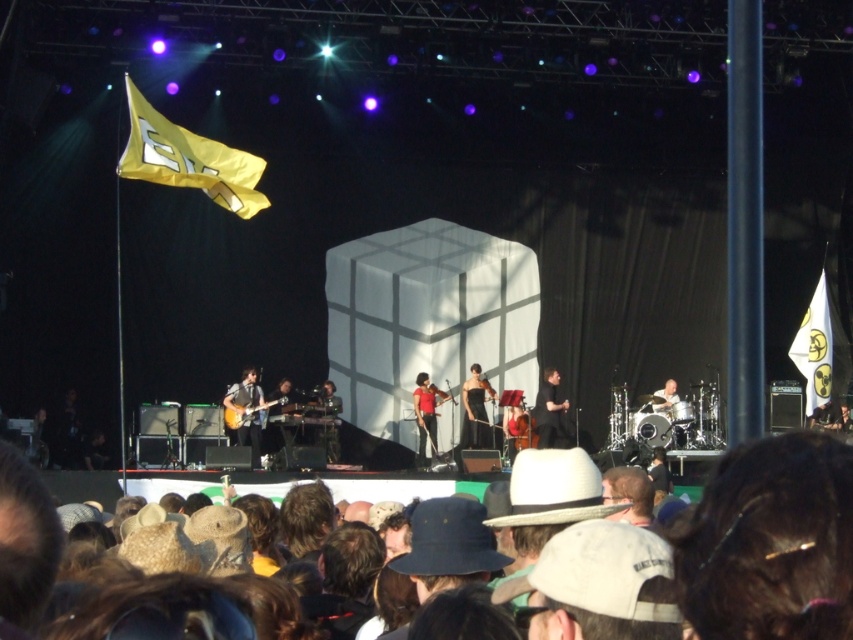
Question: Which object is the closest to the black satin dress at center?

Choices:
 (A) black felt cowboy hat at lower center
 (B) yellow fabric flag at upper left
 (C) black matte dress at center

Answer: (C)

Question: Does brown hair at lower right have a greater width compared to wooden electric guitar at center?

Choices:
 (A) yes
 (B) no

Answer: (A)

Question: Can you confirm if brown hair at lower right is wider than white fabric flag at right?

Choices:
 (A) no
 (B) yes

Answer: (B)

Question: Which of these objects is positioned closest to the black felt cowboy hat at lower center?

Choices:
 (A) black satin dress at center
 (B) white fabric flag at right
 (C) matte black guitar at left

Answer: (C)

Question: Which point is farther to the camera?

Choices:
 (A) (184, 157)
 (B) (552, 376)

Answer: (B)

Question: Can you confirm if brown hair at lower right is positioned above black matte dress at center?

Choices:
 (A) yes
 (B) no

Answer: (B)